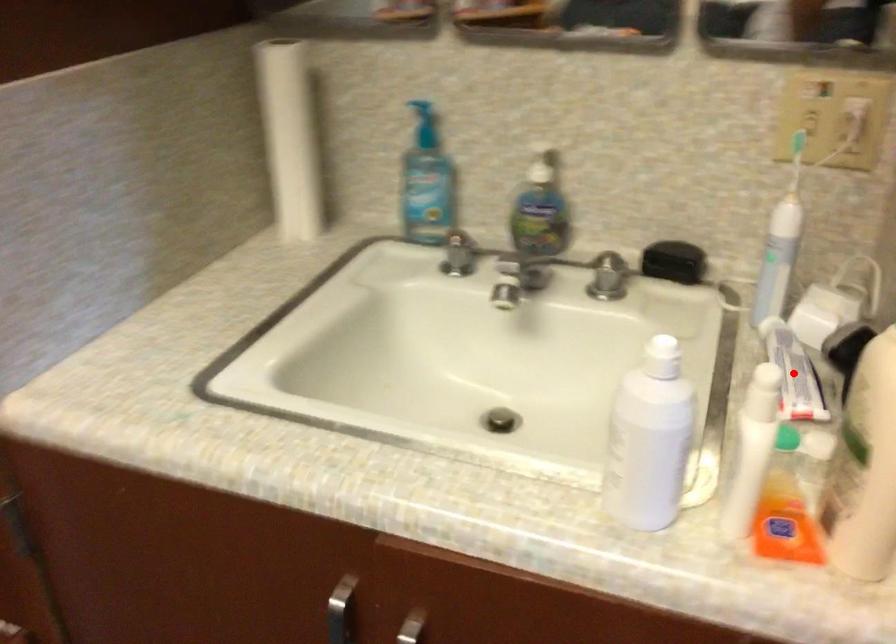
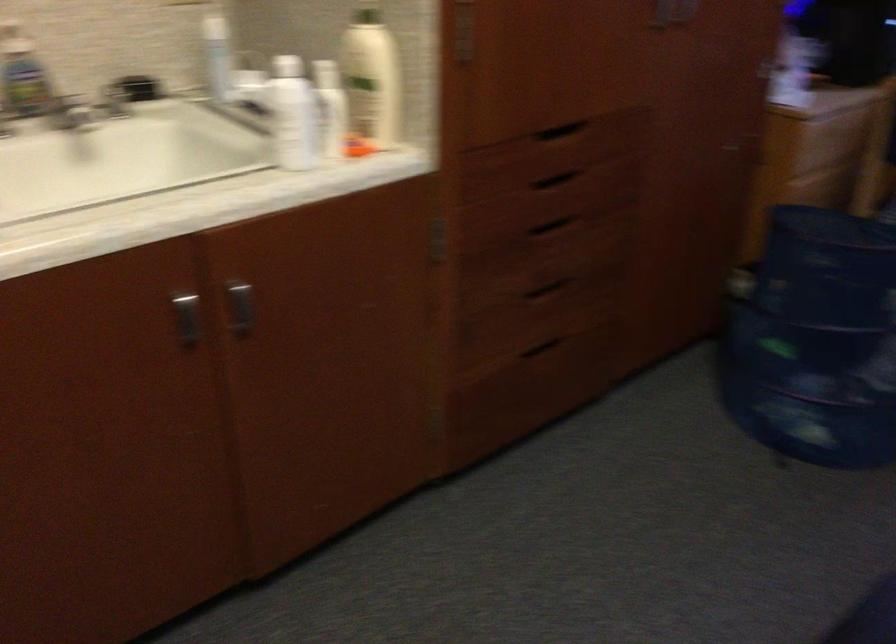
Question: I am providing you with two images of the same scene from different viewpoints. A red point is marked on the first image. At the location where the point appears in image 1, is it still visible in image 2?

Choices:
 (A) Yes
 (B) No

Answer: (B)